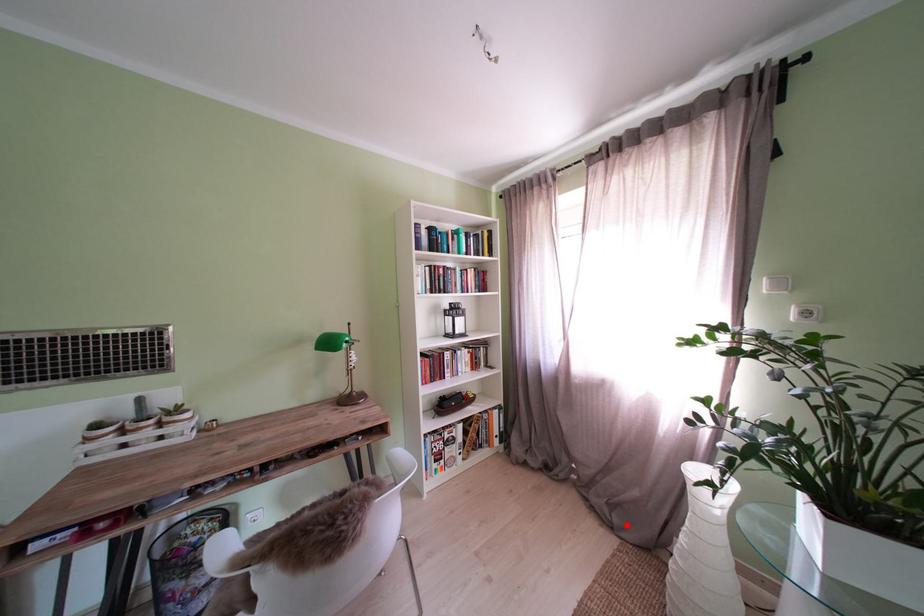
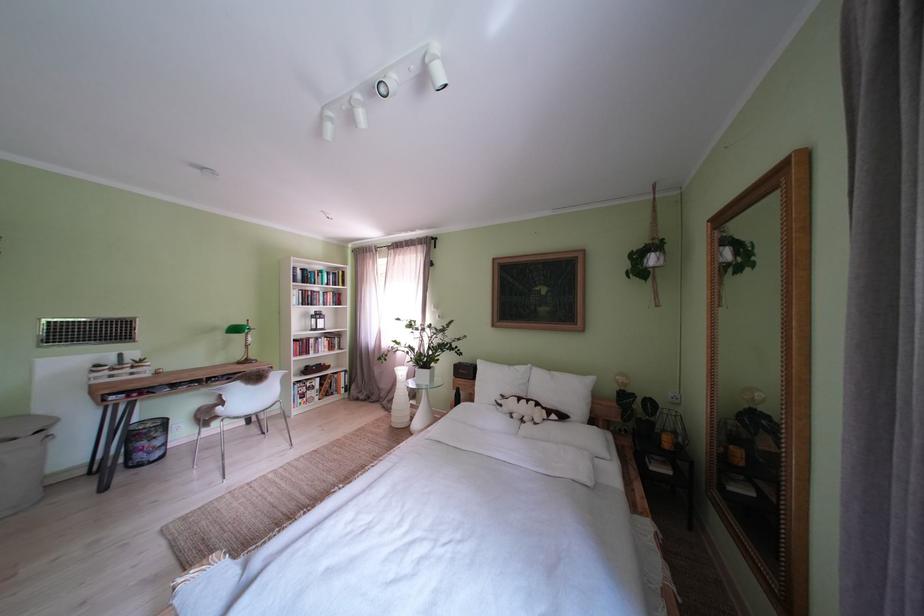
Question: I am providing you with two images of the same scene from different viewpoints. A red point is marked on the first image. Is the red point's position out of view in image 2?

Choices:
 (A) Yes
 (B) No

Answer: (B)